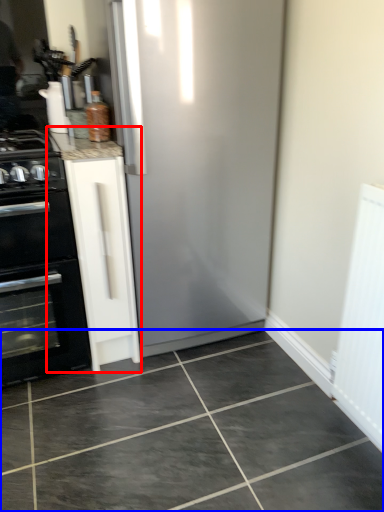
Question: Among these objects, which one is nearest to the camera, cabinetry (highlighted by a red box) or ceramic tile (highlighted by a blue box)?

Choices:
 (A) cabinetry
 (B) ceramic tile

Answer: (B)